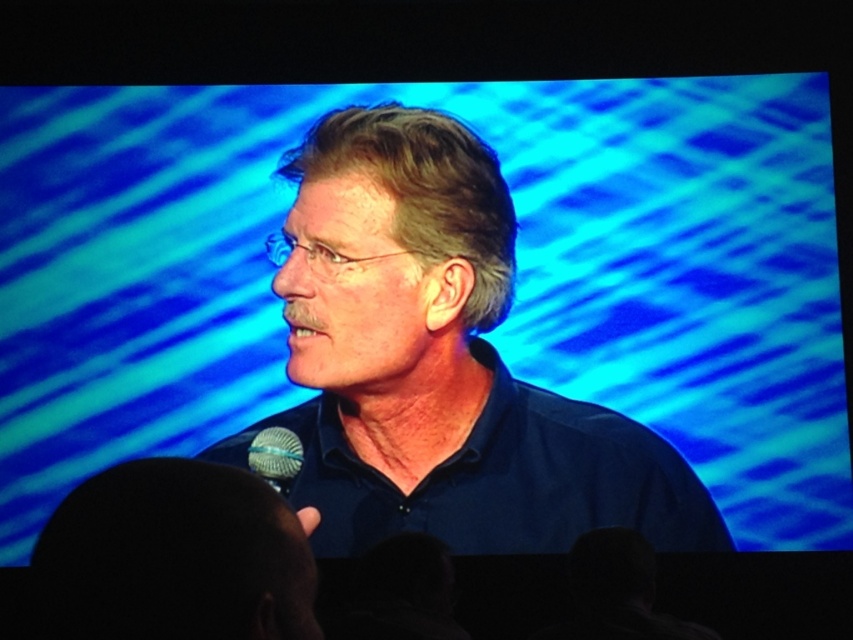
You are a photographer adjusting the lighting for a portrait. You notice the blue matte shirt at center and the satin silver microphone at lower center. Which object is positioned higher in the image?

The blue matte shirt at center is positioned higher than the satin silver microphone at lower center.

You are a photographer adjusting the camera settings to focus on the blue matte shirt at center and the satin silver microphone at lower center. Which object should you adjust the focus to first if you want to ensure both are in sharp focus, considering their sizes?

The blue matte shirt at center is much taller than the satin silver microphone at lower center, so you should focus on the larger object first to ensure depth of field covers both.

You are standing in front of the man speaking into the microphone. There are two points marked on the screen, one at coordinates point (450,288) and another at point (289,474). Which point is closer to you?

Point (289,474) is closer to you because point (450,288) is behind it according to the spatial arrangement described.